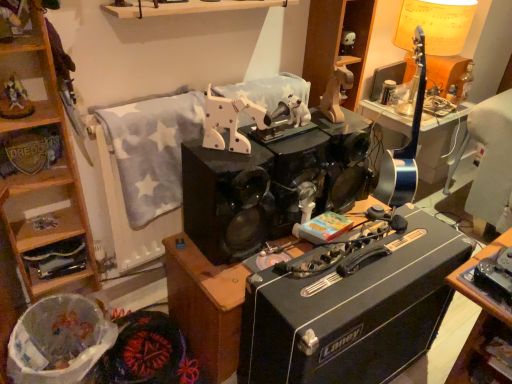
Question: From a real-world perspective, is matte yellow lampshade at upper right located higher than metallic silver badge at left, which is the 1th shelf from left to right?

Choices:
 (A) no
 (B) yes

Answer: (B)

Question: Is matte yellow lampshade at upper right in front of metallic silver badge at left, arranged as the 3th shelf when ordered from the bottom?

Choices:
 (A) yes
 (B) no

Answer: (B)

Question: Considering the relative sizes of matte yellow lampshade at upper right and metallic silver badge at left, which is the 1th shelf from left to right, in the image provided, is matte yellow lampshade at upper right thinner than metallic silver badge at left, which is the 1th shelf from left to right,?

Choices:
 (A) yes
 (B) no

Answer: (B)

Question: Is matte yellow lampshade at upper right with metallic silver badge at left, the third shelf from the right?

Choices:
 (A) no
 (B) yes

Answer: (A)

Question: Is there a large distance between matte yellow lampshade at upper right and metallic silver badge at left, the third shelf from the right?

Choices:
 (A) no
 (B) yes

Answer: (B)

Question: From the image's perspective, is matte yellow lampshade at upper right located beneath metallic silver badge at left, the third shelf from the right?

Choices:
 (A) no
 (B) yes

Answer: (A)

Question: From a real-world perspective, is matte yellow lampshade at upper right located beneath wooden shelf at lower right, which appears as the 1th shelf when viewed from the right?

Choices:
 (A) yes
 (B) no

Answer: (B)

Question: From a real-world perspective, is matte yellow lampshade at upper right physically above wooden shelf at lower right, which appears as the 1th shelf when viewed from the right?

Choices:
 (A) no
 (B) yes

Answer: (B)

Question: Is matte yellow lampshade at upper right far from wooden shelf at lower right, which appears as the 1th shelf when viewed from the right?

Choices:
 (A) yes
 (B) no

Answer: (A)

Question: Does matte yellow lampshade at upper right contain wooden shelf at lower right, which is counted as the 3th shelf, starting from the top?

Choices:
 (A) no
 (B) yes

Answer: (A)

Question: Is matte yellow lampshade at upper right further to camera compared to wooden shelf at lower right, which is counted as the 3th shelf, starting from the top?

Choices:
 (A) yes
 (B) no

Answer: (A)

Question: Can you confirm if matte yellow lampshade at upper right is shorter than wooden shelf at lower right, which is counted as the 3th shelf, starting from the top?

Choices:
 (A) no
 (B) yes

Answer: (A)

Question: Is matte yellow lampshade at upper right in contact with white plastic trash can at lower left?

Choices:
 (A) no
 (B) yes

Answer: (A)